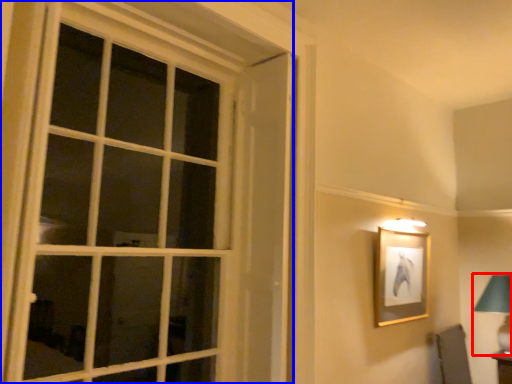
Question: Which point is closer to the camera, bedside lamp (highlighted by a red box) or window (highlighted by a blue box)?

Choices:
 (A) bedside lamp
 (B) window

Answer: (B)